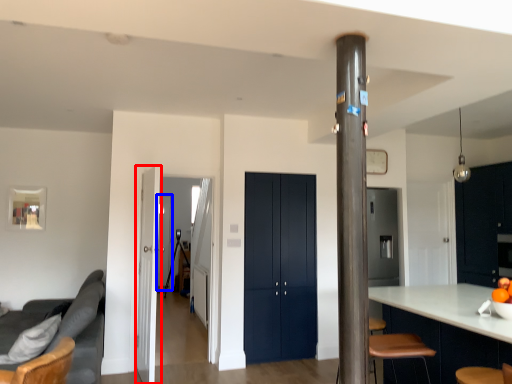
Question: Which point is closer to the camera, door (highlighted by a red box) or glass door (highlighted by a blue box)?

Choices:
 (A) door
 (B) glass door

Answer: (A)